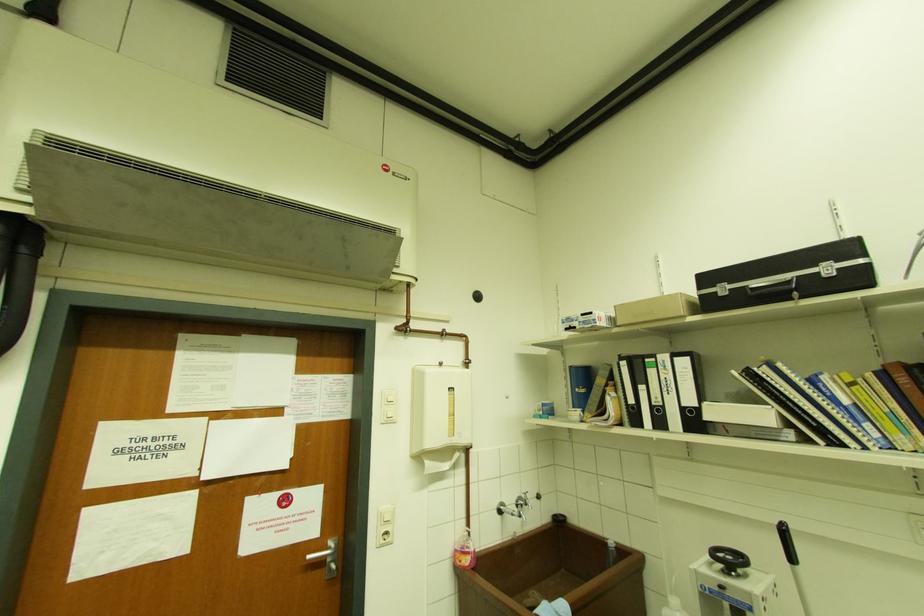
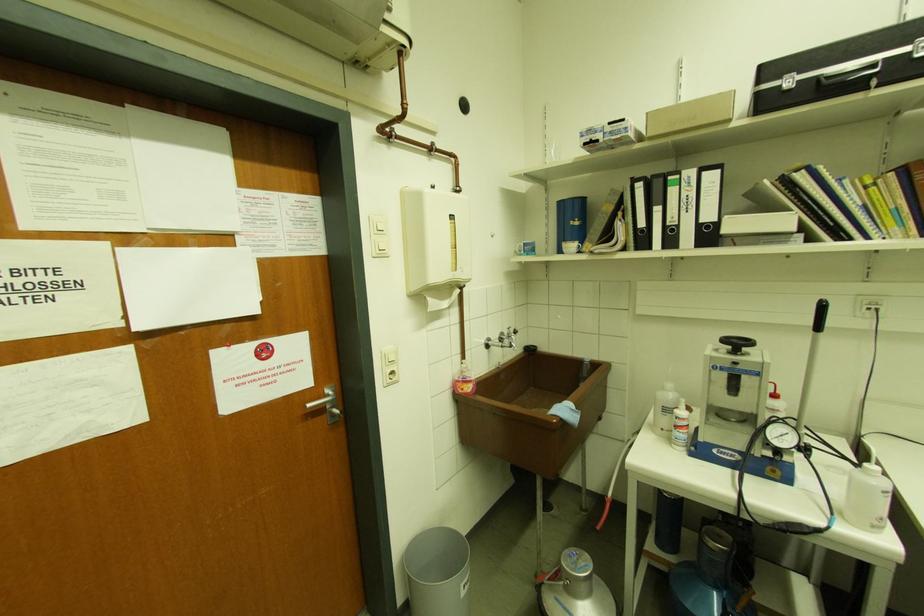
Locate, in the second image, the point that corresponds to pixel 429 463 in the first image.

(432, 300)